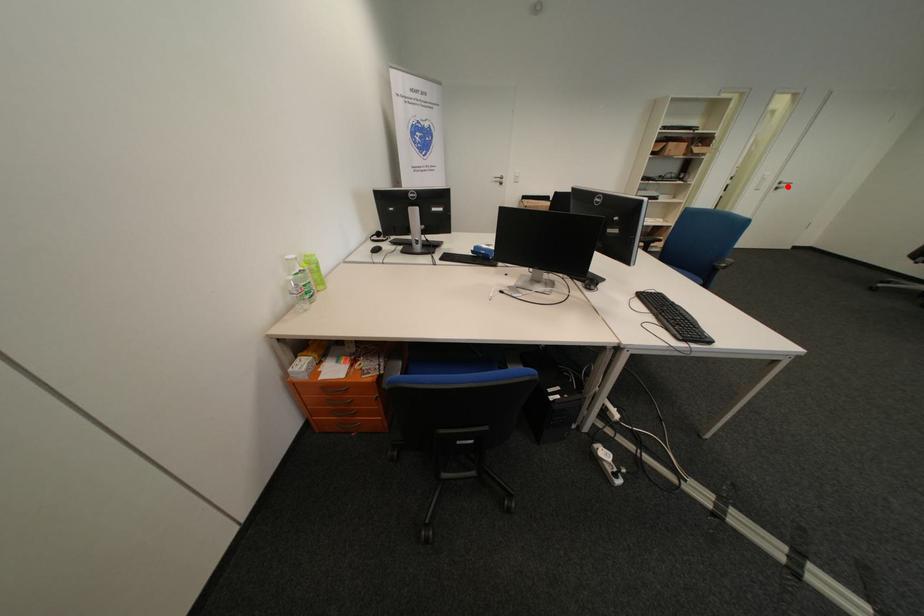
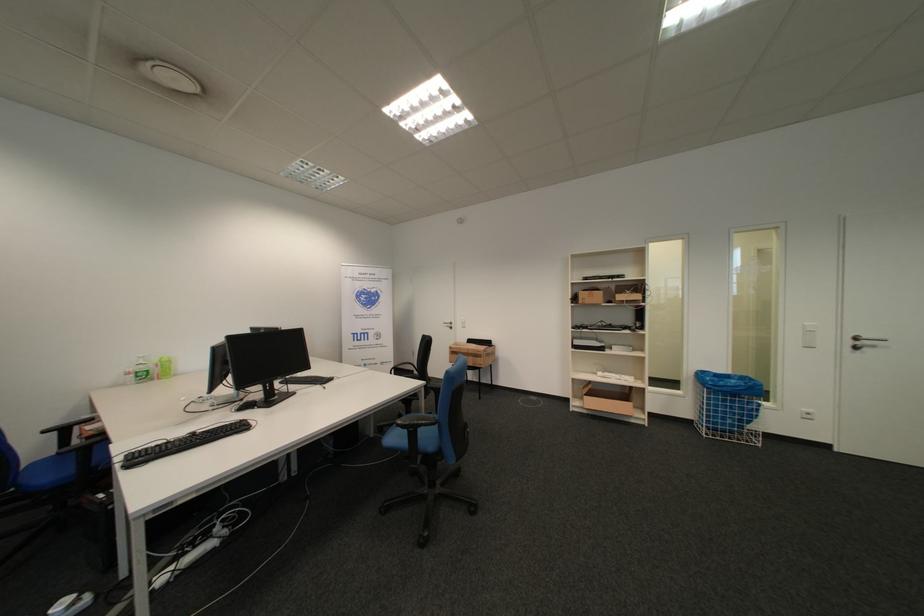
Find the pixel in the second image that matches the highlighted location in the first image.

(862, 344)